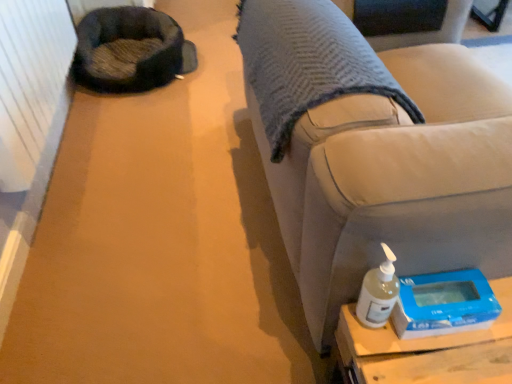
Question: Is blue plastic scale at lower right placed right next to dark gray plush bean bag chair at upper left?

Choices:
 (A) no
 (B) yes

Answer: (A)

Question: From the image's perspective, is blue plastic scale at lower right under dark gray plush bean bag chair at upper left?

Choices:
 (A) no
 (B) yes

Answer: (B)

Question: Is blue plastic scale at lower right at the right side of dark gray plush bean bag chair at upper left?

Choices:
 (A) no
 (B) yes

Answer: (B)

Question: Is blue plastic scale at lower right bigger than dark gray plush bean bag chair at upper left?

Choices:
 (A) yes
 (B) no

Answer: (B)

Question: Does blue plastic scale at lower right turn towards dark gray plush bean bag chair at upper left?

Choices:
 (A) no
 (B) yes

Answer: (B)

Question: Does blue plastic scale at lower right have a greater height compared to dark gray plush bean bag chair at upper left?

Choices:
 (A) no
 (B) yes

Answer: (A)

Question: Considering the relative sizes of white matte bottle at lower right and blue plastic scale at lower right in the image provided, is white matte bottle at lower right wider than blue plastic scale at lower right?

Choices:
 (A) no
 (B) yes

Answer: (A)

Question: Does white matte bottle at lower right appear on the right side of blue plastic scale at lower right?

Choices:
 (A) yes
 (B) no

Answer: (B)

Question: Is white matte bottle at lower right further to the viewer compared to blue plastic scale at lower right?

Choices:
 (A) yes
 (B) no

Answer: (B)

Question: From a real-world perspective, is white matte bottle at lower right located higher than blue plastic scale at lower right?

Choices:
 (A) no
 (B) yes

Answer: (B)

Question: Considering the relative sizes of white matte bottle at lower right and blue plastic scale at lower right in the image provided, is white matte bottle at lower right taller than blue plastic scale at lower right?

Choices:
 (A) no
 (B) yes

Answer: (B)

Question: Does white matte bottle at lower right have a lesser height compared to blue plastic scale at lower right?

Choices:
 (A) no
 (B) yes

Answer: (A)

Question: Is satin beige couch at lower right wider than dark gray plush bean bag chair at upper left?

Choices:
 (A) yes
 (B) no

Answer: (A)